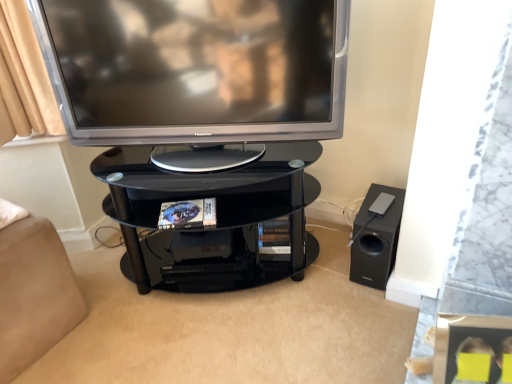
You are a GUI agent. You are given a task and a screenshot of the screen. Output one action in this format:
    pyautogui.click(x=<x>, y=<y>)
    Task: Click on the blank space to the left of black matte speaker at lower right
    
    Given the screenshot: What is the action you would take?
    pyautogui.click(x=325, y=270)